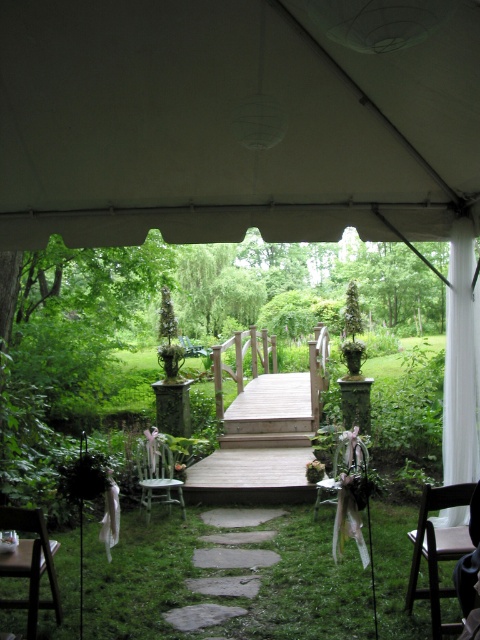
Between white fabric canopy at upper center and wooden bridge at center, which one has less height?

Result: wooden bridge at center is shorter.

Can you confirm if white fabric canopy at upper center is shorter than wooden bridge at center?

No.

Who is more forward, (250,32) or (274,438)?

Point (250,32)

Where is `white fabric canopy at upper center`? This screenshot has height=640, width=480. white fabric canopy at upper center is located at coordinates (228, 124).

Can you confirm if white fabric canopy at upper center is shorter than gray stone path at center?

No.

Who is more forward, (0,16) or (214,618)?

Point (0,16) is more forward.

Who is more distant from viewer, [396,124] or [239,550]?

Positioned behind is point [239,550].

I want to click on white fabric canopy at upper center, so click(228, 124).

Is wooden bridge at center thinner than light green painted wood chair at center?

Incorrect, wooden bridge at center's width is not less than light green painted wood chair at center's.

Is wooden bridge at center shorter than light green painted wood chair at center?

Yes.

Describe the element at coordinates (264, 432) in the screenshot. I see `wooden bridge at center` at that location.

You are a GUI agent. You are given a task and a screenshot of the screen. Output one action in this format:
    pyautogui.click(x=<x>, y=<y>)
    Task: Click on the wooden bridge at center
    
    Given the screenshot: What is the action you would take?
    pyautogui.click(x=264, y=432)